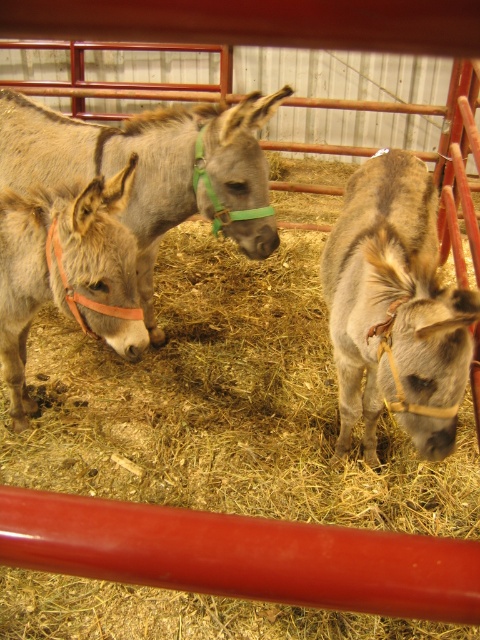
Question: Which point appears closest to the camera in this image?

Choices:
 (A) (38, 154)
 (B) (340, 337)
 (C) (49, 289)

Answer: (C)

Question: Which of the following is the farthest from the observer?

Choices:
 (A) grayish-brown leather halter at center
 (B) gray matte donkey at left
 (C) light brown leather halter at left

Answer: (B)

Question: Is gray matte donkey at left positioned in front of light brown leather halter at left?

Choices:
 (A) yes
 (B) no

Answer: (B)

Question: Estimate the real-world distances between objects in this image. Which object is closer to the gray matte donkey at left?

Choices:
 (A) grayish-brown leather halter at center
 (B) light brown leather halter at left

Answer: (B)

Question: Does grayish-brown leather halter at center come in front of gray matte donkey at left?

Choices:
 (A) no
 (B) yes

Answer: (B)

Question: Does grayish-brown leather halter at center have a smaller size compared to gray matte donkey at left?

Choices:
 (A) yes
 (B) no

Answer: (A)